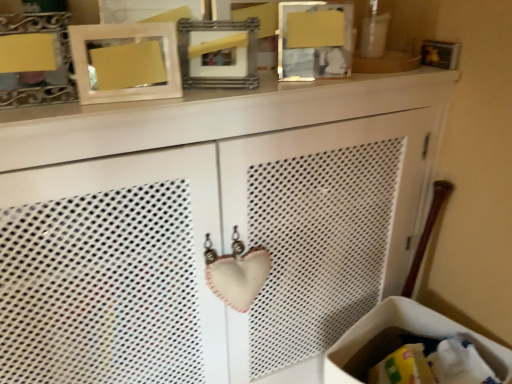
Locate an element on the screen. The image size is (512, 384). vacant space in front of matte white picture frame at upper center, marked as the 3th picture frame in a right-to-left arrangement is located at coordinates (103, 111).